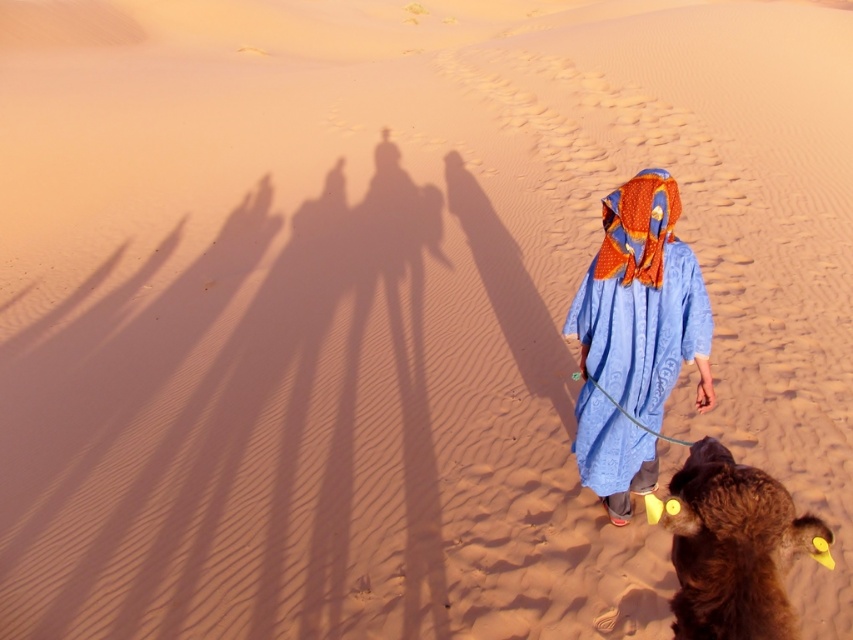
Question: Is blue woven fabric at center smaller than brown fuzzy camel at lower right?

Choices:
 (A) no
 (B) yes

Answer: (A)

Question: Does blue woven fabric at center appear over brown fuzzy camel at lower right?

Choices:
 (A) yes
 (B) no

Answer: (A)

Question: Can you confirm if blue woven fabric at center is positioned below brown fuzzy camel at lower right?

Choices:
 (A) no
 (B) yes

Answer: (A)

Question: Which point is farther to the camera?

Choices:
 (A) blue woven fabric at center
 (B) brown fuzzy camel at lower right

Answer: (A)